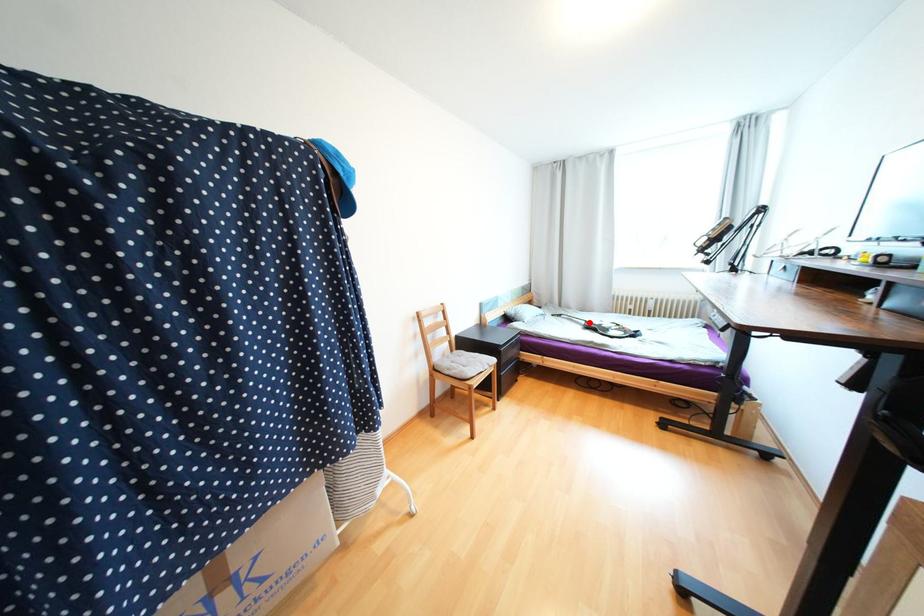
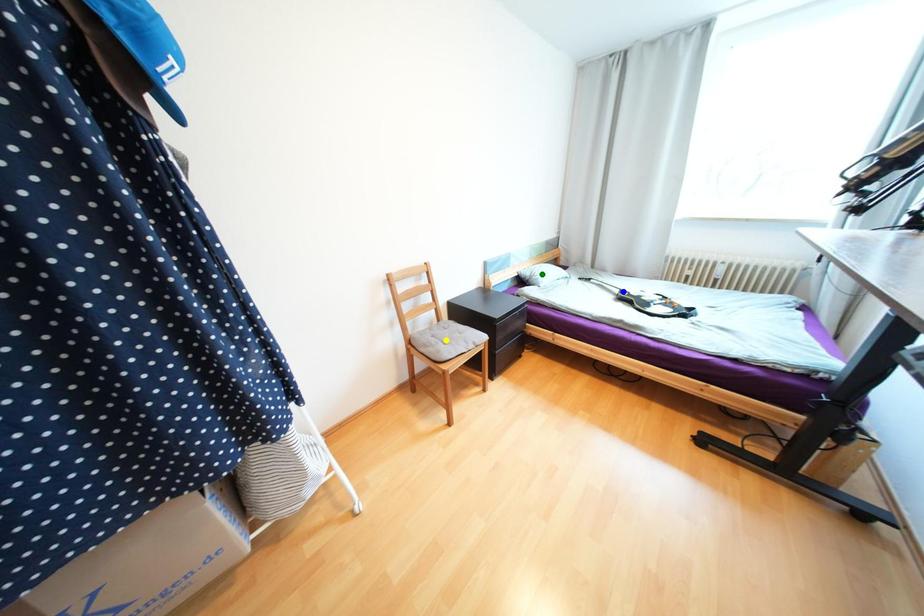
Question: I am providing you with two images of the same scene from different viewpoints. A red point is marked on the first image. You are given multiple points on the second image. Which mark in image 2 goes with the point in image 1?

Choices:
 (A) green point
 (B) blue point
 (C) yellow point

Answer: (B)